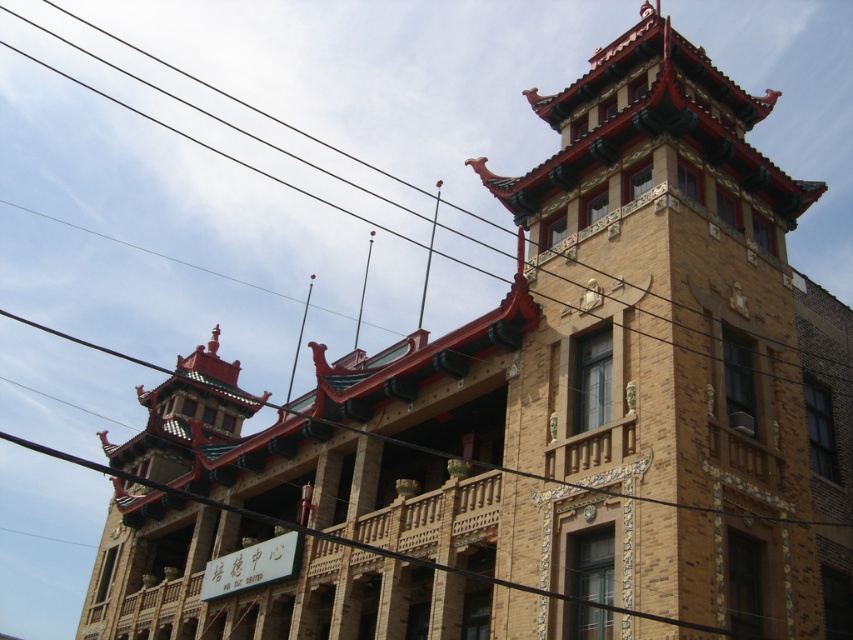
Question: Is the position of yellow brick tower at upper center more distant than that of black wire at upper center?

Choices:
 (A) no
 (B) yes

Answer: (A)

Question: Which point is closer to the camera?

Choices:
 (A) yellow brick tower at upper center
 (B) black wire at upper center

Answer: (A)

Question: Does yellow brick tower at upper center have a larger size compared to black wire at upper center?

Choices:
 (A) yes
 (B) no

Answer: (B)

Question: Is yellow brick tower at upper center further to the viewer compared to black wire at upper center?

Choices:
 (A) no
 (B) yes

Answer: (A)

Question: Which point is farther to the camera?

Choices:
 (A) (648, 481)
 (B) (88, 52)

Answer: (B)